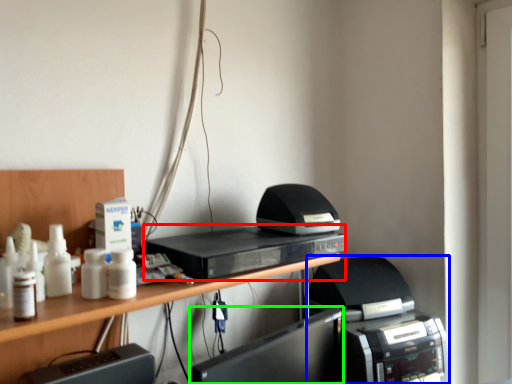
Question: Which object is positioned closest to home appliance (highlighted by a red box)? Select from printer (highlighted by a blue box) and register (highlighted by a green box).

Choices:
 (A) printer
 (B) register

Answer: (B)